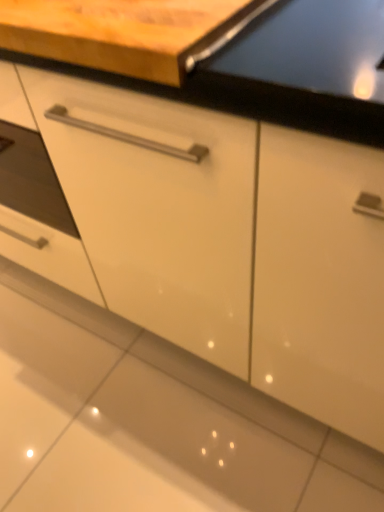
Describe the element at coordinates (118, 32) in the screenshot. I see `wooden cutting board at upper center` at that location.

Where is `wooden cutting board at upper center`? wooden cutting board at upper center is located at coordinates (118, 32).

Find the location of a particular element. This screenshot has width=384, height=512. wooden cutting board at upper center is located at coordinates (118, 32).